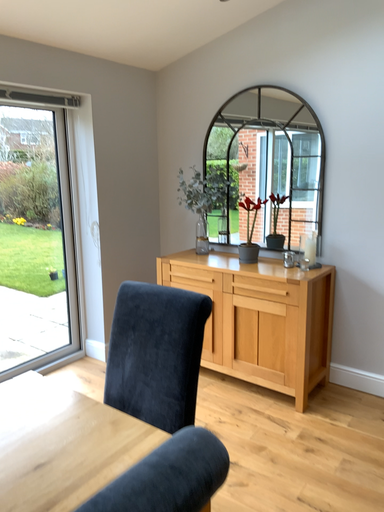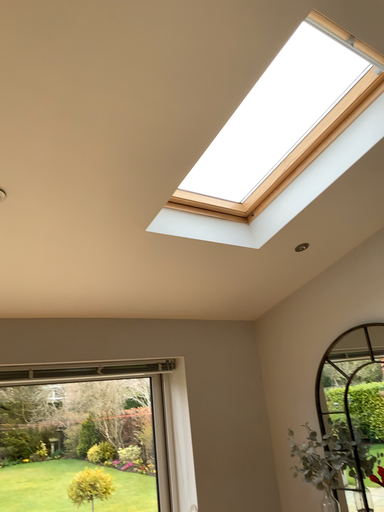
Question: Which way did the camera rotate in the video?

Choices:
 (A) rotated right
 (B) rotated left

Answer: (B)